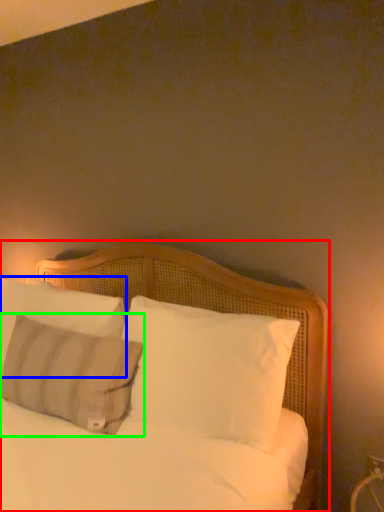
Question: Based on their relative distances, which object is farther from bed (highlighted by a red box)? Choose from pillow (highlighted by a blue box) and pillow (highlighted by a green box).

Choices:
 (A) pillow
 (B) pillow

Answer: (B)